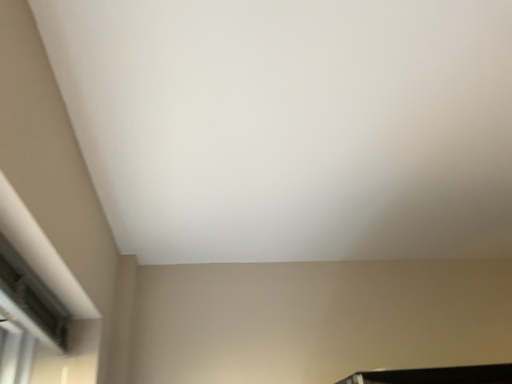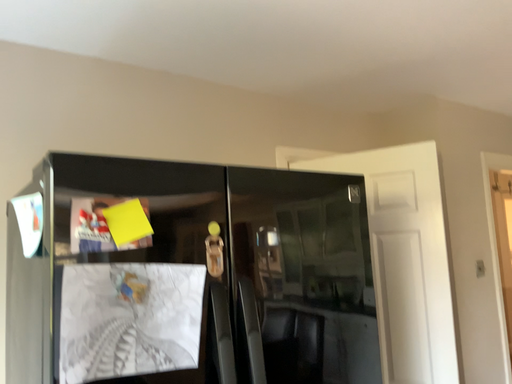
Question: Which way did the camera rotate in the video?

Choices:
 (A) rotated upward
 (B) rotated downward

Answer: (B)